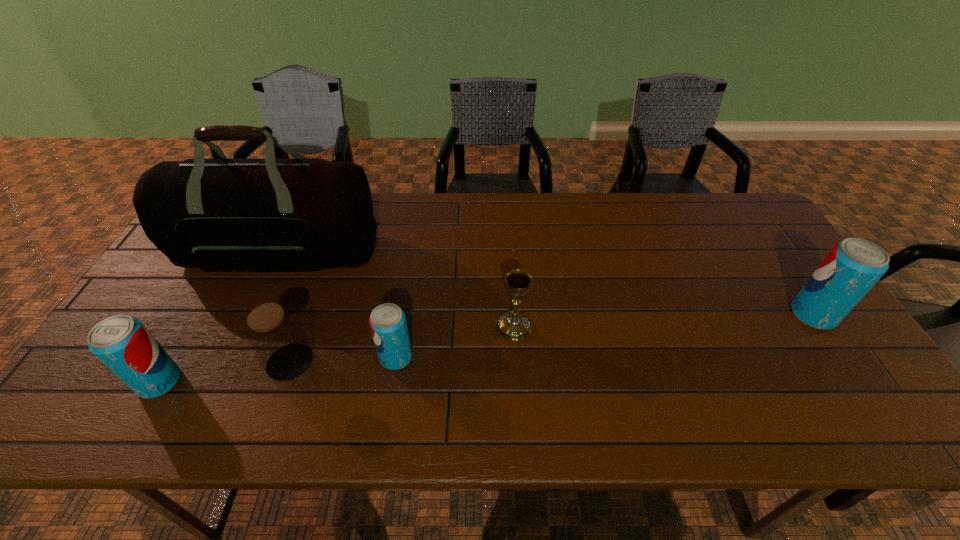
Locate an element on the screen. The height and width of the screenshot is (540, 960). vacant space situated 0.090m on the left of the second soda can from left to right is located at coordinates (343, 357).

What are the coordinates of `vacant point located on the back of the rightmost object` in the screenshot? It's located at (760, 237).

Locate an element on the screen. This screenshot has height=540, width=960. vacant space located on the left of the chalice is located at coordinates (429, 326).

Identify the location of blank area located on the front pocket of the farthest object. (223, 380).

Where is `vacant area located on the right of the jar`? Image resolution: width=960 pixels, height=540 pixels. vacant area located on the right of the jar is located at coordinates (429, 362).

Identify the location of object located in the far edge section of the desktop. The height and width of the screenshot is (540, 960). (305, 214).

Locate an element on the screen. This screenshot has width=960, height=540. jar located at the near edge is located at coordinates (275, 336).

Locate an element on the screen. The height and width of the screenshot is (540, 960). soda can that is at the left edge is located at coordinates (122, 343).

What are the coordinates of `duffel bag that is positioned at the left edge` in the screenshot? It's located at (305, 214).

The height and width of the screenshot is (540, 960). Identify the location of object at the right edge. (852, 267).